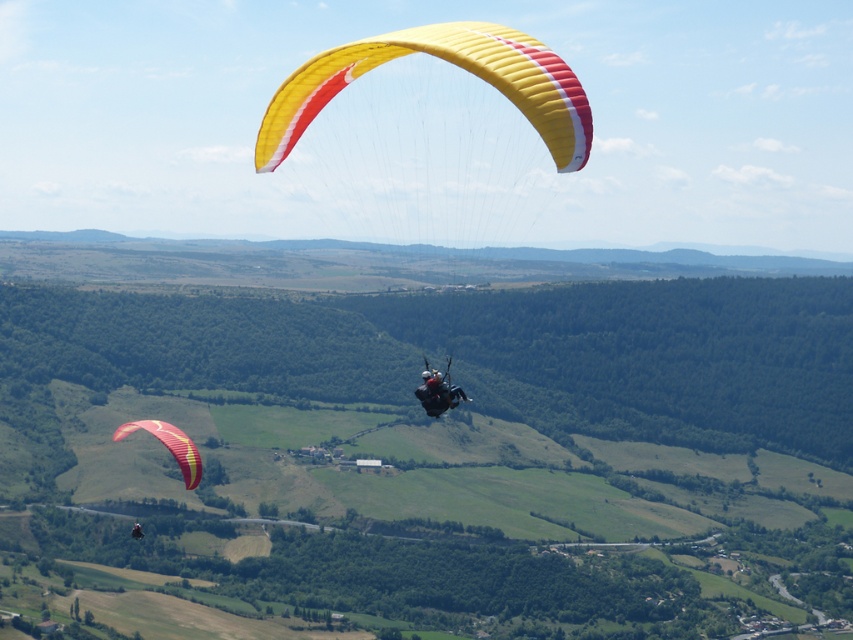
Question: Does yellow fabric parachute at lower left appear on the right side of black fabric paraglider at upper center?

Choices:
 (A) no
 (B) yes

Answer: (B)

Question: Does yellow fabric parachute at lower left appear under black fabric paraglider at upper center?

Choices:
 (A) no
 (B) yes

Answer: (A)

Question: Estimate the real-world distances between objects in this image. Which object is closer to the yellow fabric parachute at center?

Choices:
 (A) black fabric paraglider at upper center
 (B) yellow fabric parachute at lower left

Answer: (A)

Question: Estimate the real-world distances between objects in this image. Which object is closer to the black fabric paraglider at upper center?

Choices:
 (A) yellow fabric parachute at center
 (B) yellow fabric parachute at lower left

Answer: (B)

Question: Observing the image, what is the correct spatial positioning of yellow fabric parachute at center in reference to black fabric paraglider at upper center?

Choices:
 (A) below
 (B) above

Answer: (B)

Question: Which object is positioned closest to the yellow fabric parachute at center?

Choices:
 (A) yellow fabric parachute at lower left
 (B) black fabric paraglider at upper center

Answer: (B)